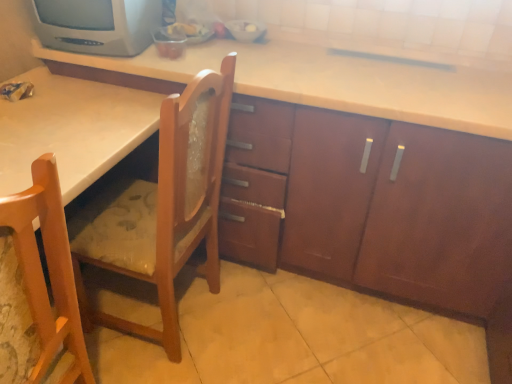
The width and height of the screenshot is (512, 384). Find the location of `vacant area that is situated to the right of wooden chair at center, acting as the 2th chair starting from the front`. vacant area that is situated to the right of wooden chair at center, acting as the 2th chair starting from the front is located at coordinates (x=262, y=328).